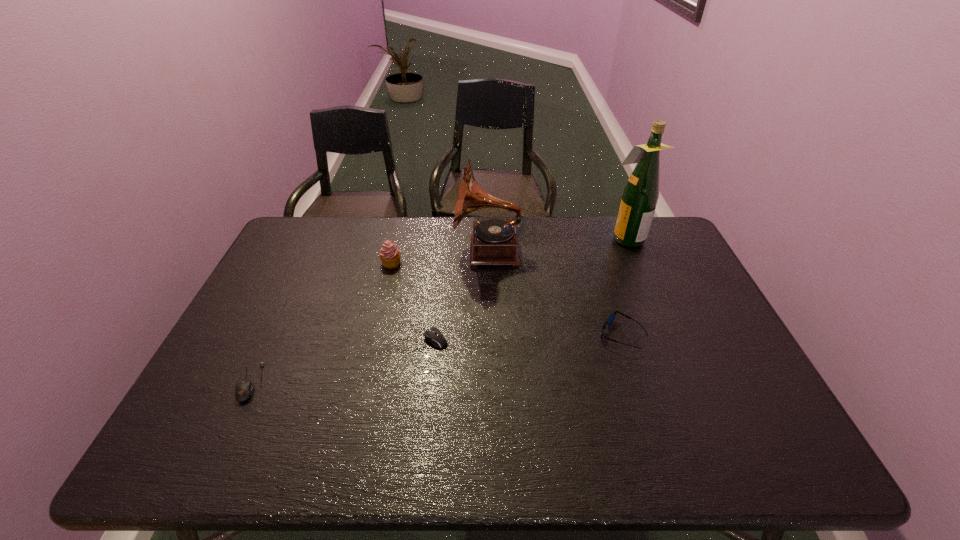
The height and width of the screenshot is (540, 960). I want to click on the rightmost object, so click(x=641, y=193).

Find the location of `the tallest object`. the tallest object is located at coordinates (641, 193).

I want to click on the fifth shortest object, so click(494, 241).

Locate an element on the screen. The width and height of the screenshot is (960, 540). cupcake is located at coordinates (389, 254).

Find the location of `the second object from left to right`. the second object from left to right is located at coordinates (389, 254).

The image size is (960, 540). Find the location of `the fifth object from left to right`. the fifth object from left to right is located at coordinates (610, 319).

Find the location of a particular element. This screenshot has width=960, height=540. sunglasses is located at coordinates (610, 319).

This screenshot has height=540, width=960. I want to click on the right mouse, so click(x=433, y=335).

You are a GUI agent. You are given a task and a screenshot of the screen. Output one action in this format:
    pyautogui.click(x=<x>, y=<y>)
    Task: Click on the nearest object
    This screenshot has height=540, width=960.
    Given the screenshot: What is the action you would take?
    pyautogui.click(x=244, y=389)

Find the location of a particular element. Image resolution: width=960 pixels, height=540 pixels. the leftmost object is located at coordinates (244, 389).